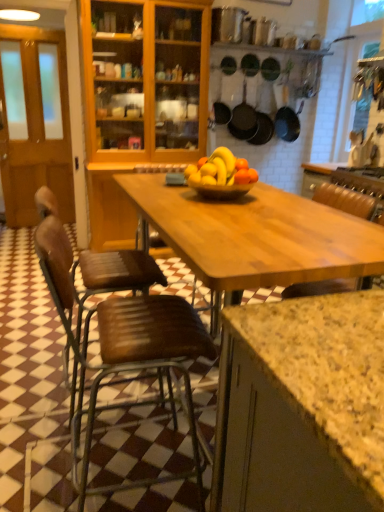
What is the approximate height of brown wooden chair at lower left, which appears as the 2th chair when viewed from the back?

brown wooden chair at lower left, which appears as the 2th chair when viewed from the back, is 38.66 inches in height.

Image resolution: width=384 pixels, height=512 pixels. Describe the element at coordinates (126, 351) in the screenshot. I see `brown wooden chair at lower left, which appears as the 2th chair when viewed from the back` at that location.

The height and width of the screenshot is (512, 384). I want to click on translucent glass bowl at center, so click(221, 190).

Image resolution: width=384 pixels, height=512 pixels. What do you see at coordinates (100, 262) in the screenshot? I see `brown wooden chair at left, which is the second chair from front to back` at bounding box center [100, 262].

This screenshot has width=384, height=512. In order to click on brown wooden chair at lower left, marked as the first chair in a front-to-back arrangement in this screenshot , I will do `click(126, 351)`.

Would you say black matte frying pan at upper center, arranged as the fourth frying pan when viewed from the left, is to the left or to the right of translucent glass bowl at center in the picture?

Clearly, black matte frying pan at upper center, arranged as the fourth frying pan when viewed from the left, is on the right of translucent glass bowl at center in the image.

Consider the image. Is translucent glass bowl at center completely or partially inside black matte frying pan at upper center, arranged as the fourth frying pan when viewed from the left?

Definitely not — translucent glass bowl at center is not inside black matte frying pan at upper center, arranged as the fourth frying pan when viewed from the left.

Which point is more distant from viewer, (x=278, y=114) or (x=234, y=189)?

Positioned behind is point (x=278, y=114).

Locate an element on the screen. The image size is (384, 512). frying pan that is the 4th object located behind the translucent glass bowl at center is located at coordinates (286, 115).

Considering the relative sizes of matte black frying pan at upper center, the second frying pan in the right-to-left sequence, and translucent glass bowl at center in the image provided, is matte black frying pan at upper center, the second frying pan in the right-to-left sequence, thinner than translucent glass bowl at center?

Correct, the width of matte black frying pan at upper center, the second frying pan in the right-to-left sequence, is less than that of translucent glass bowl at center.

Is matte black frying pan at upper center, the second frying pan in the right-to-left sequence, next to translucent glass bowl at center and touching it?

No.

Based on the photo, is matte black frying pan at upper center, which appears as the 3th frying pan when viewed from the left, in front of or behind translucent glass bowl at center in the image?

In the image, matte black frying pan at upper center, which appears as the 3th frying pan when viewed from the left, appears behind translucent glass bowl at center.

Is matte black frying pan at upper center, which appears as the 3th frying pan when viewed from the left, not inside translucent glass bowl at center?

Yes, matte black frying pan at upper center, which appears as the 3th frying pan when viewed from the left, is not within translucent glass bowl at center.

In the image, is brown wooden chair at left, positioned as the 1th chair in back-to-front order, on the left side or the right side of black matte frying pan at upper center, marked as the first frying pan in a right-to-left arrangement?

In the image, brown wooden chair at left, positioned as the 1th chair in back-to-front order, appears on the left side of black matte frying pan at upper center, marked as the first frying pan in a right-to-left arrangement.

From the image's perspective, is brown wooden chair at left, positioned as the 1th chair in back-to-front order, on top of black matte frying pan at upper center, marked as the first frying pan in a right-to-left arrangement?

No, from the image's perspective, brown wooden chair at left, positioned as the 1th chair in back-to-front order, is not on top of black matte frying pan at upper center, marked as the first frying pan in a right-to-left arrangement.

Which of these two, brown wooden chair at left, positioned as the 1th chair in back-to-front order, or black matte frying pan at upper center, marked as the first frying pan in a right-to-left arrangement, is bigger?

brown wooden chair at left, positioned as the 1th chair in back-to-front order, is bigger.

Is black matte frying pan at upper center, marked as the first frying pan in a right-to-left arrangement, aimed at brown wooden door at left?

No, black matte frying pan at upper center, marked as the first frying pan in a right-to-left arrangement, does not turn towards brown wooden door at left.

Can you confirm if black matte frying pan at upper center, arranged as the fourth frying pan when viewed from the left, is thinner than brown wooden door at left?

Incorrect, the width of black matte frying pan at upper center, arranged as the fourth frying pan when viewed from the left, is not less than that of brown wooden door at left.

Is black matte frying pan at upper center, arranged as the fourth frying pan when viewed from the left, bigger than brown wooden door at left?

Actually, black matte frying pan at upper center, arranged as the fourth frying pan when viewed from the left, might be smaller than brown wooden door at left.

Could you measure the distance between black matte frying pan at upper center, marked as the first frying pan in a right-to-left arrangement, and brown wooden door at left?

black matte frying pan at upper center, marked as the first frying pan in a right-to-left arrangement, and brown wooden door at left are 7.96 feet apart from each other.

Is matte black frying pan at center, the third frying pan from the right, taller or shorter than black matte frying pan at center, placed as the 1th frying pan when sorted from left to right?

In the image, matte black frying pan at center, the third frying pan from the right, appears to be taller than black matte frying pan at center, placed as the 1th frying pan when sorted from left to right.

From a real-world perspective, between matte black frying pan at center, the second frying pan viewed from the left, and black matte frying pan at center, positioned as the 4th frying pan in right-to-left order, who is vertically lower?

From a 3D spatial view, matte black frying pan at center, the second frying pan viewed from the left, is below.

From the image's perspective, would you say matte black frying pan at center, the third frying pan from the right, is shown under black matte frying pan at center, positioned as the 4th frying pan in right-to-left order?

Indeed, from the image's perspective, matte black frying pan at center, the third frying pan from the right, is shown beneath black matte frying pan at center, positioned as the 4th frying pan in right-to-left order.

Which is correct: brown wooden door at left is inside matte black frying pan at center, the second frying pan viewed from the left, or outside of it?

brown wooden door at left is outside matte black frying pan at center, the second frying pan viewed from the left.

Consider the image. Between brown wooden door at left and matte black frying pan at center, the third frying pan from the right, which one has larger width?

Wider between the two is matte black frying pan at center, the third frying pan from the right.

Considering the positions of objects brown wooden door at left and matte black frying pan at center, the third frying pan from the right, in the image provided, who is more to the right, brown wooden door at left or matte black frying pan at center, the third frying pan from the right,?

Positioned to the right is matte black frying pan at center, the third frying pan from the right.

Is brown wooden door at left positioned in front of matte black frying pan at center, the third frying pan from the right?

Yes, brown wooden door at left is in front of matte black frying pan at center, the third frying pan from the right.

Which of these two, translucent glass bowl at center or brown wooden chair at lower left, which appears as the 2th chair when viewed from the back, is smaller?

translucent glass bowl at center is smaller.

What's the angular difference between translucent glass bowl at center and brown wooden chair at lower left, marked as the first chair in a front-to-back arrangement,'s facing directions?

The angle between the facing direction of translucent glass bowl at center and the facing direction of brown wooden chair at lower left, marked as the first chair in a front-to-back arrangement, is 1.11 degrees.

Which of these two, translucent glass bowl at center or brown wooden chair at lower left, marked as the first chair in a front-to-back arrangement, is thinner?

Thinner between the two is translucent glass bowl at center.

The image size is (384, 512). Identify the location of glass bowl lying in front of the black matte frying pan at upper center, marked as the first frying pan in a right-to-left arrangement. (221, 190).

In the image, there is a matte black frying pan at upper center, which appears as the 3th frying pan when viewed from the left. In order to click on glass bowl below it (from a real-world perspective) in this screenshot , I will do `click(221, 190)`.

From the image, which object appears to be nearer to brown wooden chair at lower left, which appears as the 2th chair when viewed from the back, brown wooden chair at left, positioned as the 1th chair in back-to-front order, or matte black frying pan at upper center, the second frying pan in the right-to-left sequence?

brown wooden chair at left, positioned as the 1th chair in back-to-front order, lies closer to brown wooden chair at lower left, which appears as the 2th chair when viewed from the back, than the other object.

Which object lies nearer to the anchor point translucent glass bowl at center, black matte frying pan at center, placed as the 1th frying pan when sorted from left to right, or black matte frying pan at upper center, arranged as the fourth frying pan when viewed from the left?

The object closer to translucent glass bowl at center is black matte frying pan at center, placed as the 1th frying pan when sorted from left to right.

Which object lies nearer to the anchor point matte black frying pan at center, the second frying pan viewed from the left, brown wooden chair at lower left, which appears as the 2th chair when viewed from the back, or matte black frying pan at upper center, the second frying pan in the right-to-left sequence?

The object closer to matte black frying pan at center, the second frying pan viewed from the left, is matte black frying pan at upper center, the second frying pan in the right-to-left sequence.

Which object lies nearer to the anchor point matte black frying pan at center, the second frying pan viewed from the left, black matte frying pan at upper center, marked as the first frying pan in a right-to-left arrangement, or brown wooden chair at left, which is the second chair from front to back?

Based on the image, black matte frying pan at upper center, marked as the first frying pan in a right-to-left arrangement, appears to be nearer to matte black frying pan at center, the second frying pan viewed from the left.

Based on their spatial positions, is black matte frying pan at center, positioned as the 4th frying pan in right-to-left order, or brown wooden door at left further from brown wooden chair at left, which is the second chair from front to back?

brown wooden door at left lies further to brown wooden chair at left, which is the second chair from front to back, than the other object.

In the scene shown: Estimate the real-world distances between objects in this image. Which object is further from brown wooden door at left, matte black frying pan at upper center, the second frying pan in the right-to-left sequence, or brown wooden chair at lower left, marked as the first chair in a front-to-back arrangement?

brown wooden chair at lower left, marked as the first chair in a front-to-back arrangement, is further to brown wooden door at left.

Considering their positions, is matte black frying pan at center, the third frying pan from the right, positioned closer to black matte frying pan at center, positioned as the 4th frying pan in right-to-left order, than translucent glass bowl at center?

matte black frying pan at center, the third frying pan from the right, is positioned closer to the anchor black matte frying pan at center, positioned as the 4th frying pan in right-to-left order.

Which object lies nearer to the anchor point brown wooden chair at lower left, marked as the first chair in a front-to-back arrangement, matte black frying pan at center, the third frying pan from the right, or brown wooden door at left?

matte black frying pan at center, the third frying pan from the right, is closer to brown wooden chair at lower left, marked as the first chair in a front-to-back arrangement.

Identify the location of glass door between translucent glass bowl at center and matte black frying pan at center, the second frying pan viewed from the left, along the z-axis. The image size is (384, 512). (35, 126).

What are the coordinates of `frying pan located between brown wooden chair at left, positioned as the 1th chair in back-to-front order, and matte black frying pan at center, the third frying pan from the right, in the depth direction` in the screenshot? It's located at (218, 101).

Where is `glass door positioned between brown wooden chair at lower left, marked as the first chair in a front-to-back arrangement, and black matte frying pan at center, positioned as the 4th frying pan in right-to-left order, from near to far`? The image size is (384, 512). glass door positioned between brown wooden chair at lower left, marked as the first chair in a front-to-back arrangement, and black matte frying pan at center, positioned as the 4th frying pan in right-to-left order, from near to far is located at coordinates (35, 126).

Locate an element on the screen. The image size is (384, 512). glass bowl between brown wooden chair at left, positioned as the 1th chair in back-to-front order, and matte black frying pan at upper center, which appears as the 3th frying pan when viewed from the left, from front to back is located at coordinates (221, 190).